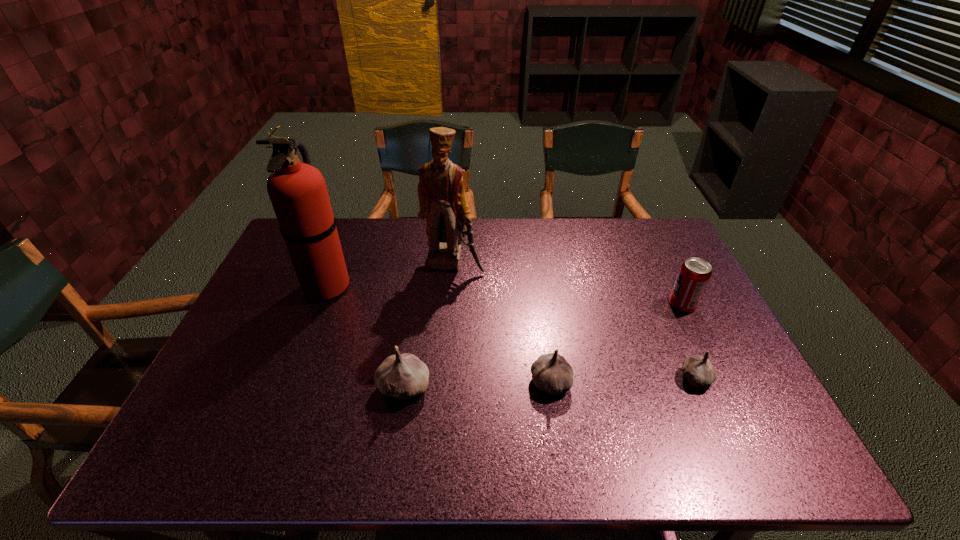
In the image, there is a desktop. Where is `vacant space at the near edge`? Image resolution: width=960 pixels, height=540 pixels. vacant space at the near edge is located at coordinates (355, 393).

In the image, there is a desktop. At what (x,y) coordinates should I click in order to perform the action: click on vacant space at the right edge. Please return your answer as a coordinate pair (x, y). This screenshot has width=960, height=540. Looking at the image, I should click on (661, 296).

This screenshot has width=960, height=540. In the image, there is a desktop. What are the coordinates of `vacant space at the near right corner` in the screenshot? It's located at (749, 402).

Image resolution: width=960 pixels, height=540 pixels. In order to click on vacant area that lies between the leftmost garlic and the second shortest garlic in this screenshot , I will do `click(477, 384)`.

Where is `free space between the soda can and the leftmost garlic`? The height and width of the screenshot is (540, 960). free space between the soda can and the leftmost garlic is located at coordinates (543, 346).

The width and height of the screenshot is (960, 540). I want to click on empty location between the second shortest object and the leftmost garlic, so click(x=477, y=384).

Locate an element on the screen. The image size is (960, 540). vacant space in between the leftmost object and the leftmost garlic is located at coordinates (366, 336).

Locate an element on the screen. This screenshot has height=540, width=960. free space between the leftmost object and the rightmost garlic is located at coordinates [x=511, y=332].

Locate an element on the screen. The width and height of the screenshot is (960, 540). free space between the shortest garlic and the fire extinguisher is located at coordinates (511, 332).

At what (x,y) coordinates should I click in order to perform the action: click on free spot between the soda can and the nutcracker. Please return your answer as a coordinate pair (x, y). This screenshot has height=540, width=960. Looking at the image, I should click on (567, 284).